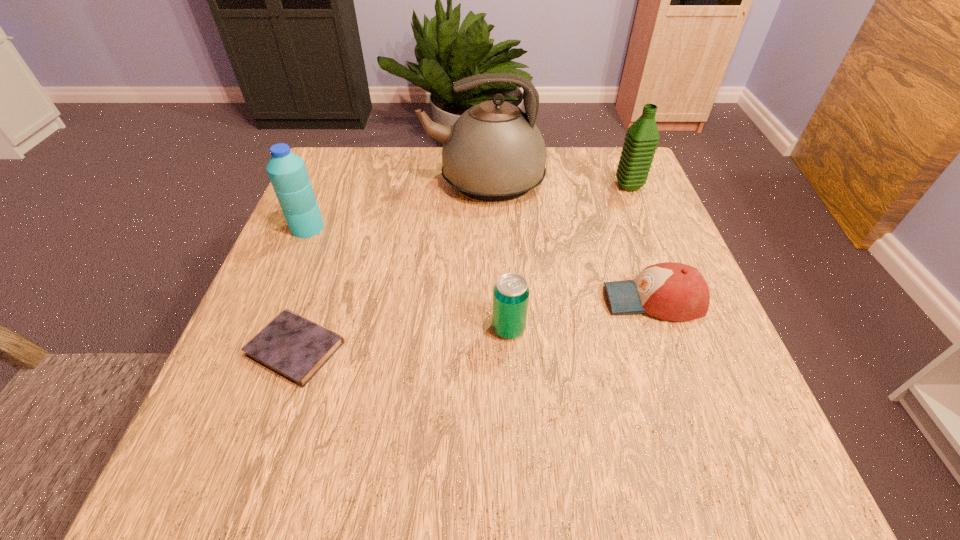
Locate an element on the screen. kettle is located at coordinates (494, 152).

At what (x,y) coordinates should I click in order to perform the action: click on the right water bottle. Please return your answer as a coordinate pair (x, y). Looking at the image, I should click on (642, 137).

The image size is (960, 540). Find the location of `the third farthest object`. the third farthest object is located at coordinates (288, 174).

Where is `the left water bottle`? The height and width of the screenshot is (540, 960). the left water bottle is located at coordinates (288, 174).

Locate an element on the screen. the fourth tallest object is located at coordinates (511, 293).

At what (x,y) coordinates should I click in order to perform the action: click on baseball cap. Please return your answer as a coordinate pair (x, y). Looking at the image, I should click on (671, 291).

This screenshot has height=540, width=960. I want to click on diary, so click(x=291, y=346).

At what (x,y) coordinates should I click in order to perform the action: click on vacant area situated at the spout of the tallest object. Please return your answer as a coordinate pair (x, y). Looking at the image, I should click on (366, 183).

You are a GUI agent. You are given a task and a screenshot of the screen. Output one action in this format:
    pyautogui.click(x=<x>, y=<y>)
    Task: Click on the vacant region located at the spout of the tallest object
    This screenshot has height=540, width=960.
    Given the screenshot: What is the action you would take?
    pyautogui.click(x=398, y=183)

The height and width of the screenshot is (540, 960). I want to click on vacant region located 0.080m at the spout of the tallest object, so click(391, 183).